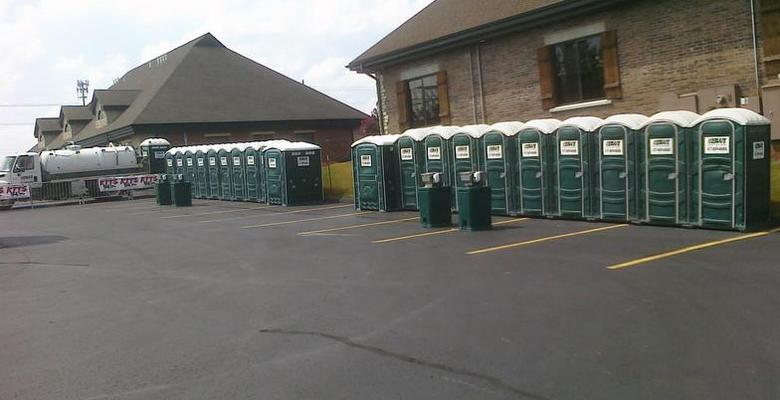
You are a GUI agent. You are given a task and a screenshot of the screen. Output one action in this format:
    pyautogui.click(x=<x>, y=<y>)
    Task: Click on the handwashing stations
    
    Given the screenshot: What is the action you would take?
    pyautogui.click(x=162, y=187), pyautogui.click(x=179, y=188), pyautogui.click(x=437, y=191), pyautogui.click(x=473, y=195)